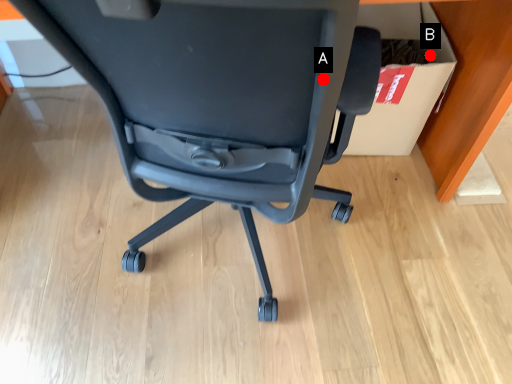
Question: Two points are circled on the image, labeled by A and B beside each circle. Which point appears farthest from the camera in this image?

Choices:
 (A) A is further
 (B) B is further

Answer: (B)